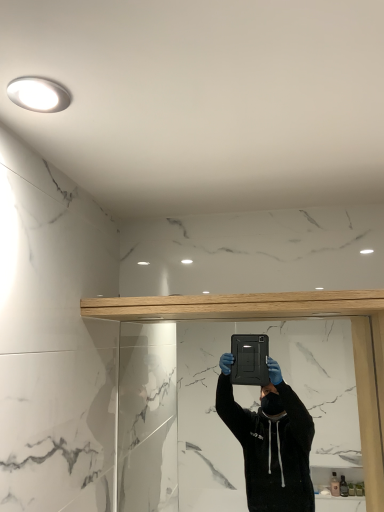
Question: Does black matte mirror at center turn towards light oak wood beam at upper center?

Choices:
 (A) no
 (B) yes

Answer: (B)

Question: Is black matte mirror at center in contact with light oak wood beam at upper center?

Choices:
 (A) yes
 (B) no

Answer: (B)

Question: Does black matte mirror at center have a lesser height compared to light oak wood beam at upper center?

Choices:
 (A) yes
 (B) no

Answer: (B)

Question: Does black matte mirror at center have a smaller size compared to light oak wood beam at upper center?

Choices:
 (A) no
 (B) yes

Answer: (B)

Question: Considering the relative sizes of black matte mirror at center and light oak wood beam at upper center in the image provided, is black matte mirror at center thinner than light oak wood beam at upper center?

Choices:
 (A) yes
 (B) no

Answer: (A)

Question: Is black matte mirror at center behind light oak wood beam at upper center?

Choices:
 (A) no
 (B) yes

Answer: (B)

Question: Considering the relative positions of light oak wood beam at upper center and white glossy light fixture at upper left in the image provided, is light oak wood beam at upper center to the left of white glossy light fixture at upper left from the viewer's perspective?

Choices:
 (A) yes
 (B) no

Answer: (B)

Question: Can you confirm if light oak wood beam at upper center is wider than white glossy light fixture at upper left?

Choices:
 (A) no
 (B) yes

Answer: (B)

Question: Considering the relative positions of light oak wood beam at upper center and white glossy light fixture at upper left in the image provided, is light oak wood beam at upper center behind white glossy light fixture at upper left?

Choices:
 (A) yes
 (B) no

Answer: (A)

Question: Can you confirm if light oak wood beam at upper center is bigger than white glossy light fixture at upper left?

Choices:
 (A) no
 (B) yes

Answer: (B)

Question: From a real-world perspective, is light oak wood beam at upper center below white glossy light fixture at upper left?

Choices:
 (A) no
 (B) yes

Answer: (B)

Question: Considering the relative sizes of light oak wood beam at upper center and white glossy light fixture at upper left in the image provided, is light oak wood beam at upper center thinner than white glossy light fixture at upper left?

Choices:
 (A) no
 (B) yes

Answer: (A)

Question: From a real-world perspective, is black matte mirror at center over white glossy light fixture at upper left?

Choices:
 (A) no
 (B) yes

Answer: (A)